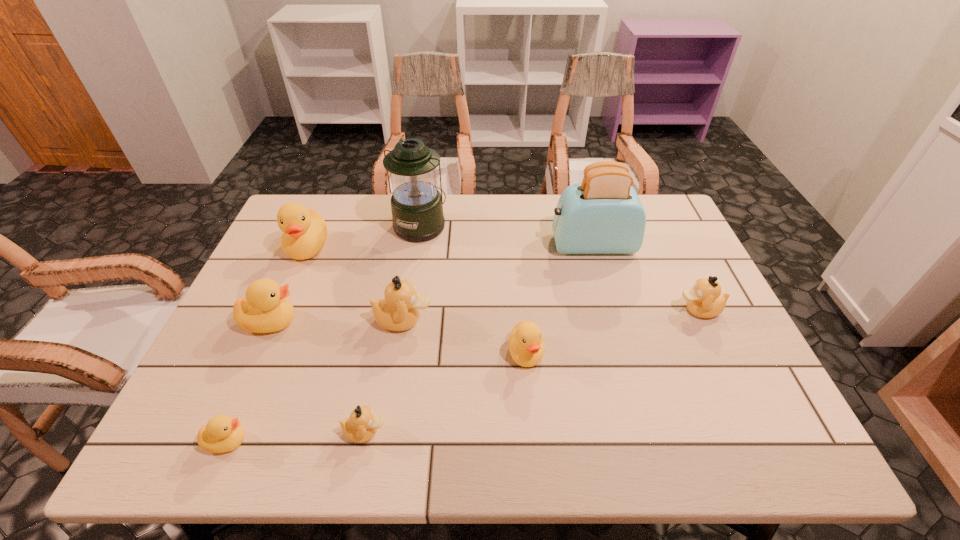
Find the location of a particular element. Image resolution: width=960 pixels, height=540 pixels. free space located on the face of the second smallest tan duckling is located at coordinates (551, 310).

The width and height of the screenshot is (960, 540). Find the location of `vacant area situated 0.380m on the face of the second smallest tan duckling`. vacant area situated 0.380m on the face of the second smallest tan duckling is located at coordinates (532, 310).

Find the location of a particular element. The height and width of the screenshot is (540, 960). free space located 0.300m on the face of the second smallest tan duckling is located at coordinates (563, 310).

You are a GUI agent. You are given a task and a screenshot of the screen. Output one action in this format:
    pyautogui.click(x=<x>, y=<y>)
    Task: Click on the free space located on the face of the third biggest yellow duckling
    The image size is (960, 540).
    Given the screenshot: What is the action you would take?
    pyautogui.click(x=532, y=422)

This screenshot has width=960, height=540. Find the location of `vacant region located on the face of the nearest tan duckling`. vacant region located on the face of the nearest tan duckling is located at coordinates (507, 432).

Locate an element on the screen. The image size is (960, 540). free region located 0.080m on the face of the smallest yellow duckling is located at coordinates (288, 441).

Locate an element on the screen. The image size is (960, 540). lantern situated at the far edge is located at coordinates (416, 204).

This screenshot has width=960, height=540. I want to click on toaster situated at the far edge, so click(602, 215).

At what (x,y) coordinates should I click in order to perform the action: click on duckling positioned at the far edge. Please return your answer as a coordinate pair (x, y). The height and width of the screenshot is (540, 960). Looking at the image, I should click on (304, 230).

Image resolution: width=960 pixels, height=540 pixels. Find the location of `object present at the right edge`. object present at the right edge is located at coordinates (704, 300).